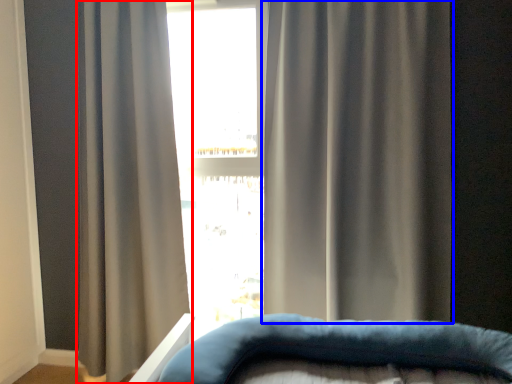
Question: Which point is closer to the camera, curtain (highlighted by a red box) or curtain (highlighted by a blue box)?

Choices:
 (A) curtain
 (B) curtain

Answer: (B)